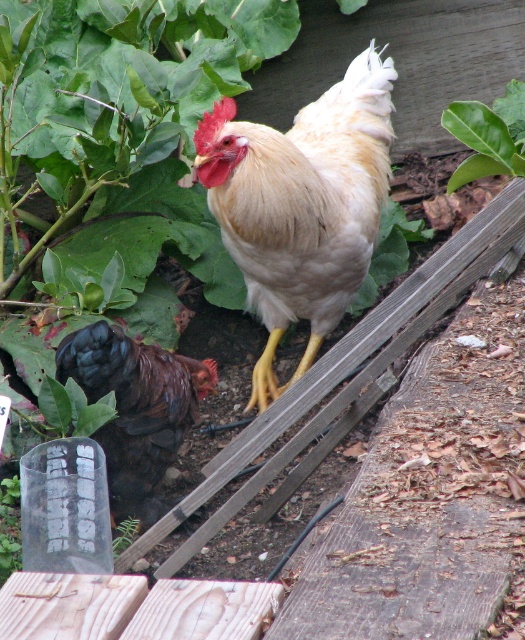
Question: Does golden feathered rooster at center have a larger size compared to dark brown feathers at center?

Choices:
 (A) yes
 (B) no

Answer: (A)

Question: Is dark brown feathers at center wider than green leafy at upper center?

Choices:
 (A) no
 (B) yes

Answer: (B)

Question: Which point is closer to the camera?

Choices:
 (A) (145, 444)
 (B) (330, 221)
 (C) (498, 140)

Answer: (C)

Question: Which point is farther from the camera taking this photo?

Choices:
 (A) [502, 120]
 (B) [176, 449]
 (C) [349, 156]

Answer: (A)

Question: Which point is closer to the camera taking this photo?

Choices:
 (A) (301, 237)
 (B) (88, 328)

Answer: (B)

Question: Can you confirm if dark brown feathers at center is positioned above green leafy at upper center?

Choices:
 (A) no
 (B) yes

Answer: (A)